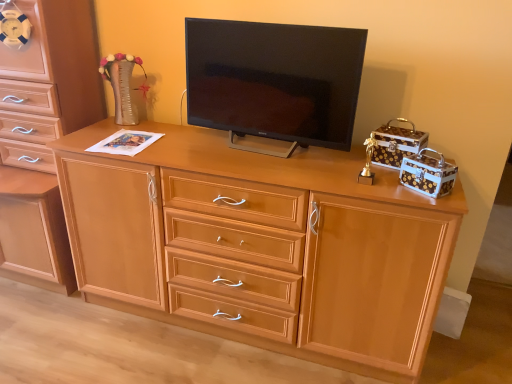
What do you see at coordinates (42, 136) in the screenshot? The image size is (512, 384). I see `light brown wood chest of drawers at left` at bounding box center [42, 136].

Find the location of a particular element. This screenshot has height=384, width=512. light wood cabinet at center is located at coordinates (262, 245).

Locate an element on the screen. The width and height of the screenshot is (512, 384). light brown wood chest of drawers at left is located at coordinates tap(42, 136).

Where is `desk on the right side of light brown wood chest of drawers at left`? This screenshot has width=512, height=384. desk on the right side of light brown wood chest of drawers at left is located at coordinates (262, 245).

Is light wood cabinet at center aimed at light brown wood chest of drawers at left?

No, light wood cabinet at center is not oriented towards light brown wood chest of drawers at left.

Do you think light wood cabinet at center is within light brown wood chest of drawers at left, or outside of it?

light wood cabinet at center is located beyond the bounds of light brown wood chest of drawers at left.

Between point (138, 225) and point (7, 130), which one is positioned behind?

The point (7, 130) is farther.

Does matte black tv at center turn towards light brown wood chest of drawers at left?

No, matte black tv at center is not aimed at light brown wood chest of drawers at left.

Can you confirm if matte black tv at center is positioned to the right of light brown wood chest of drawers at left?

Yes, matte black tv at center is to the right of light brown wood chest of drawers at left.

Does matte black tv at center come in front of light brown wood chest of drawers at left?

That is True.

From the image's perspective, which is below, light brown wood chest of drawers at left or matte black tv at center?

From the image's view, light brown wood chest of drawers at left is below.

Would you say light brown wood chest of drawers at left is outside matte black tv at center?

Yes, light brown wood chest of drawers at left is outside of matte black tv at center.

Based on the photo, considering the relative sizes of light brown wood chest of drawers at left and matte black tv at center in the image provided, is light brown wood chest of drawers at left smaller than matte black tv at center?

No.

Is point (17, 241) closer or farther from the camera than point (311, 111)?

Point (17, 241).

Considering the relative positions of matte black tv at center and light wood cabinet at center in the image provided, is matte black tv at center behind light wood cabinet at center?

That is True.

The image size is (512, 384). In order to click on television lying behind the light wood cabinet at center in this screenshot , I will do `click(274, 80)`.

From the picture: Between matte black tv at center and light wood cabinet at center, which one has larger width?

With larger width is light wood cabinet at center.

Could you tell me if matte black tv at center is facing light wood cabinet at center?

No, matte black tv at center is not turned towards light wood cabinet at center.

Is light brown wood chest of drawers at left wider or thinner than light wood cabinet at center?

Clearly, light brown wood chest of drawers at left has more width compared to light wood cabinet at center.

Which of these two, light brown wood chest of drawers at left or light wood cabinet at center, is bigger?

With larger size is light brown wood chest of drawers at left.

Which is more to the right, light brown wood chest of drawers at left or light wood cabinet at center?

light wood cabinet at center.

Does light wood cabinet at center have a greater width compared to matte black tv at center?

Yes.

Which point is more forward, (232, 196) or (221, 45)?

Positioned in front is point (232, 196).

Is light wood cabinet at center to the right of matte black tv at center from the viewer's perspective?

No, light wood cabinet at center is not to the right of matte black tv at center.

In the image, there is a light brown wood chest of drawers at left. At what (x,y) coordinates should I click in order to perform the action: click on desk below it (from the image's perspective). Please return your answer as a coordinate pair (x, y). This screenshot has width=512, height=384. Looking at the image, I should click on (262, 245).

At what (x,y) coordinates should I click in order to perform the action: click on television in front of the light brown wood chest of drawers at left. Please return your answer as a coordinate pair (x, y). Looking at the image, I should click on (274, 80).

When comparing their distances from light brown wood chest of drawers at left, does matte black tv at center or light wood cabinet at center seem further?

matte black tv at center is further to light brown wood chest of drawers at left.

Which object lies further to the anchor point light wood cabinet at center, light brown wood chest of drawers at left or matte black tv at center?

light brown wood chest of drawers at left is further to light wood cabinet at center.

When comparing their distances from light brown wood chest of drawers at left, does light wood cabinet at center or matte black tv at center seem further?

The object further to light brown wood chest of drawers at left is matte black tv at center.

Considering their positions, is light brown wood chest of drawers at left positioned closer to matte black tv at center than light wood cabinet at center?

light wood cabinet at center is closer to matte black tv at center.

Looking at the image, which one is located closer to light wood cabinet at center, matte black tv at center or light brown wood chest of drawers at left?

Based on the image, matte black tv at center appears to be nearer to light wood cabinet at center.

Estimate the real-world distances between objects in this image. Which object is closer to matte black tv at center, light wood cabinet at center or light brown wood chest of drawers at left?

Among the two, light wood cabinet at center is located nearer to matte black tv at center.

Where is `desk situated between light brown wood chest of drawers at left and matte black tv at center from left to right`? This screenshot has width=512, height=384. desk situated between light brown wood chest of drawers at left and matte black tv at center from left to right is located at coordinates (262, 245).